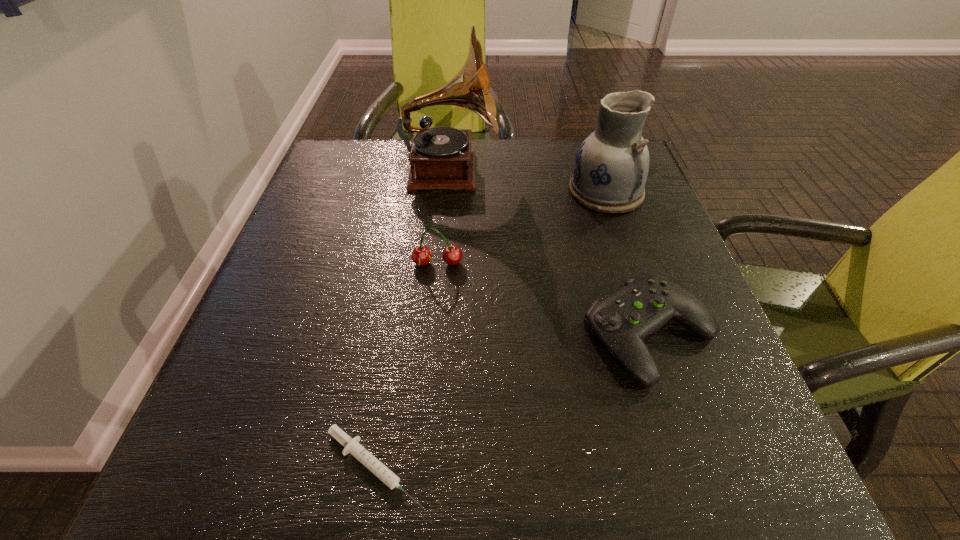
Identify the location of unoccupied position between the third shortest object and the second nearest object. This screenshot has width=960, height=540. (543, 299).

Find the location of `unoccupied position between the cherry and the nearest object`. unoccupied position between the cherry and the nearest object is located at coordinates (406, 365).

At what (x,y) coordinates should I click in order to perform the action: click on free area in between the fourth farthest object and the pottery. Please return your answer as a coordinate pair (x, y). This screenshot has height=540, width=960. Looking at the image, I should click on (628, 263).

You are a GUI agent. You are given a task and a screenshot of the screen. Output one action in this format:
    pyautogui.click(x=<x>, y=<y>)
    Task: Click on the object that is the fourth closest to the fourth shortest object
    
    Given the screenshot: What is the action you would take?
    pyautogui.click(x=352, y=446)

Select which object is the closest to the nearest object. Please provide its 2D coordinates. Your answer should be formatted as a tuple, i.e. [(x, y)], where the tuple contains the x and y coordinates of a point satisfying the conditions above.

[(647, 302)]

The height and width of the screenshot is (540, 960). In order to click on vacant space that satisfies the following two spatial constraints: 1. on the horn of the tallest object; 2. on the right side of the pottery in this screenshot , I will do `click(449, 192)`.

I want to click on vacant point that satisfies the following two spatial constraints: 1. on the back side of the fourth shortest object; 2. on the right side of the nearest object, so click(x=420, y=192).

Find the location of a particular element. The height and width of the screenshot is (540, 960). vacant space that satisfies the following two spatial constraints: 1. on the horn of the tallest object; 2. on the front side of the shortest object is located at coordinates (426, 467).

The width and height of the screenshot is (960, 540). In order to click on vacant space that satisfies the following two spatial constraints: 1. on the horn of the second shortest object; 2. on the right side of the phonograph_record in this screenshot , I will do `click(437, 334)`.

Identify the location of free spot that satisfies the following two spatial constraints: 1. on the horn of the tallest object; 2. on the left side of the second nearest object. Image resolution: width=960 pixels, height=540 pixels. (437, 334).